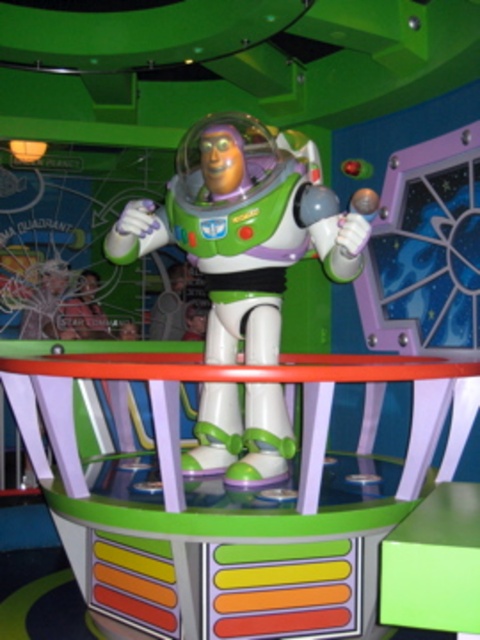
Is white plastic astronaut at center to the right of green plastic stool at center from the viewer's perspective?

No, white plastic astronaut at center is not to the right of green plastic stool at center.

Is white plastic astronaut at center above green plastic stool at center?

Indeed, white plastic astronaut at center is positioned over green plastic stool at center.

Which is in front, point (259, 161) or point (444, 593)?

Point (444, 593) is more forward.

The image size is (480, 640). Find the location of `white plastic astronaut at center`. white plastic astronaut at center is located at coordinates (243, 228).